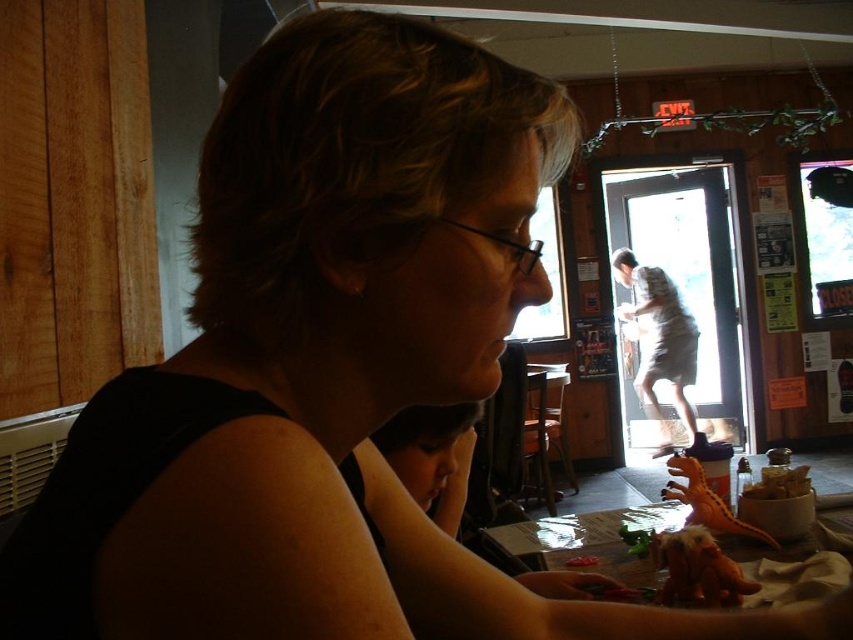
Who is more distant from viewer, [614,524] or [773,472]?

The point [614,524] is more distant.

What do you see at coordinates (592, 540) in the screenshot?
I see `wooden table at lower center` at bounding box center [592, 540].

This screenshot has height=640, width=853. I want to click on wooden table at lower center, so click(x=592, y=540).